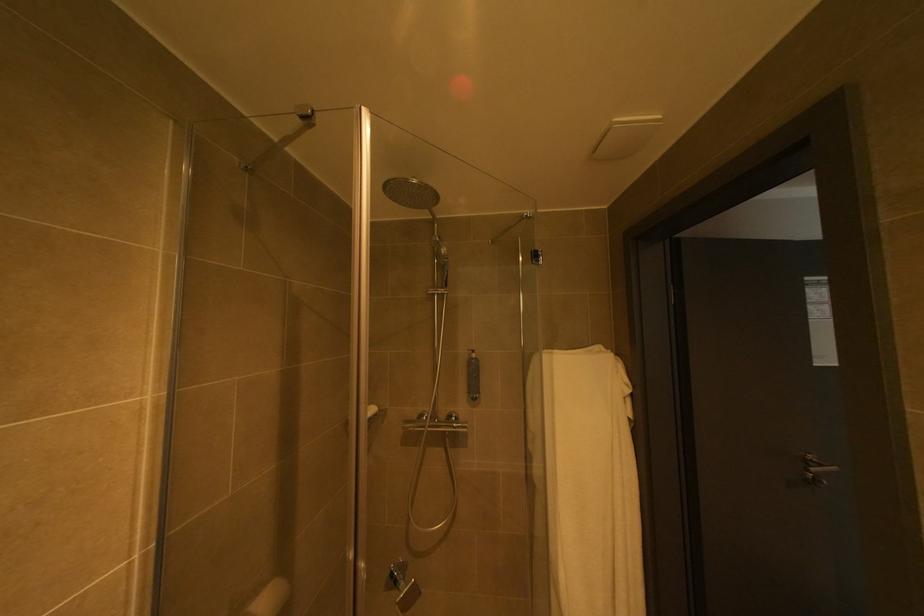
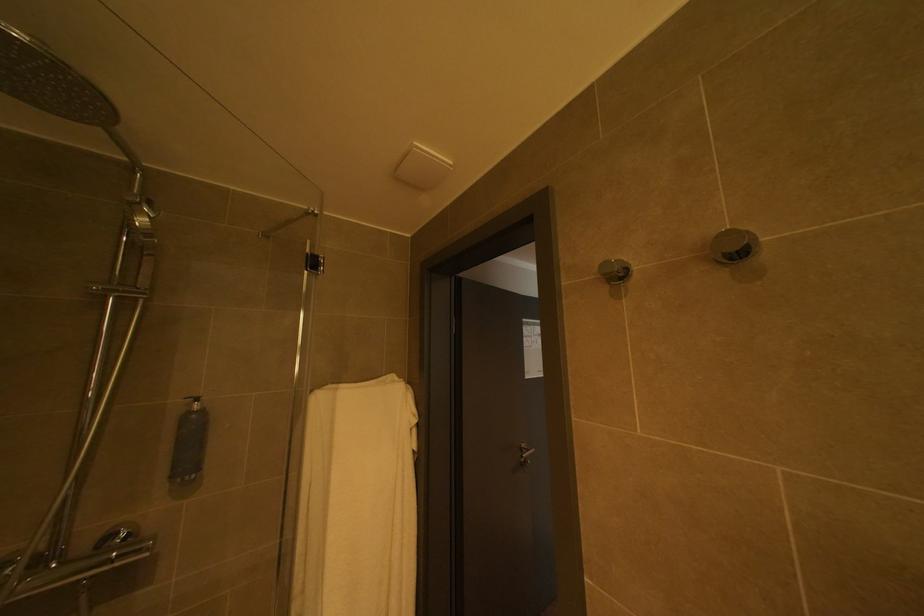
The point at [464,418] is marked in the first image. Where is the corresponding point in the second image?

(128, 535)